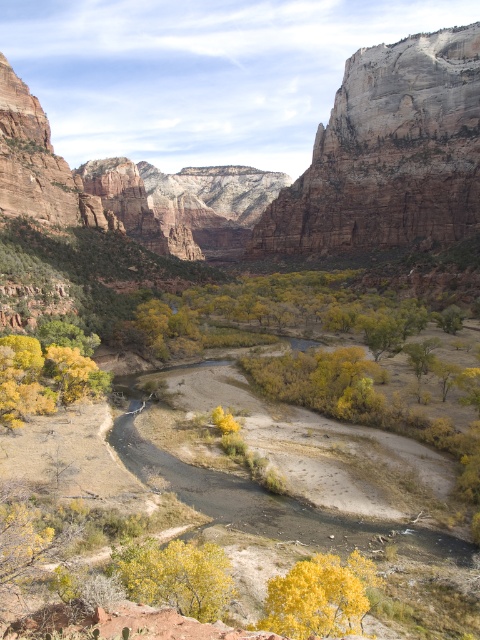
Question: Does yellow leafy tree at lower center appear on the left side of yellow matte tree at left?

Choices:
 (A) yes
 (B) no

Answer: (B)

Question: Is yellow matte tree at center positioned before yellow matte tree at left?

Choices:
 (A) no
 (B) yes

Answer: (B)

Question: Is yellow leafy tree at lower center further to camera compared to yellow matte tree at left?

Choices:
 (A) yes
 (B) no

Answer: (B)

Question: Based on their relative distances, which object is nearer to the yellow matte tree at center?

Choices:
 (A) yellow matte tree at left
 (B) yellow leafy tree at lower center

Answer: (B)

Question: Which point is closer to the camera?

Choices:
 (A) yellow matte tree at center
 (B) yellow matte tree at left
 (C) yellow leafy tree at lower center

Answer: (A)

Question: Which object is positioned farthest from the yellow matte tree at center?

Choices:
 (A) yellow matte tree at left
 (B) yellow leafy tree at lower center

Answer: (A)